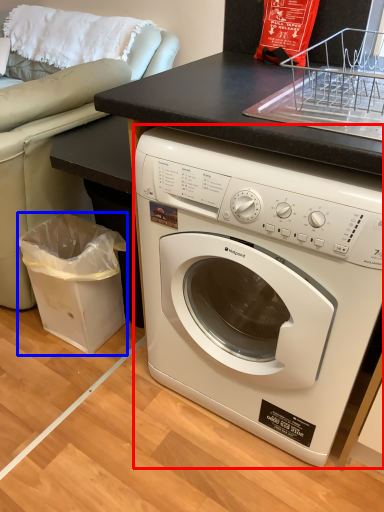
Question: Which of the following is the farthest to the observer, washing machine (highlighted by a red box) or garbage (highlighted by a blue box)?

Choices:
 (A) washing machine
 (B) garbage

Answer: (B)